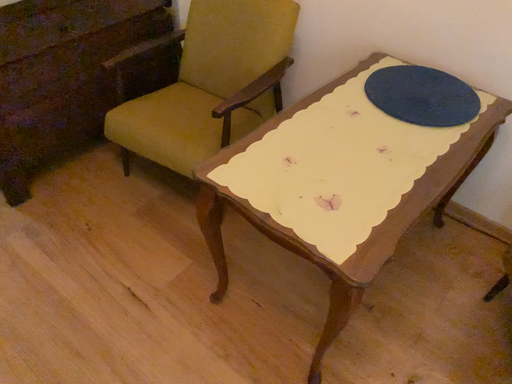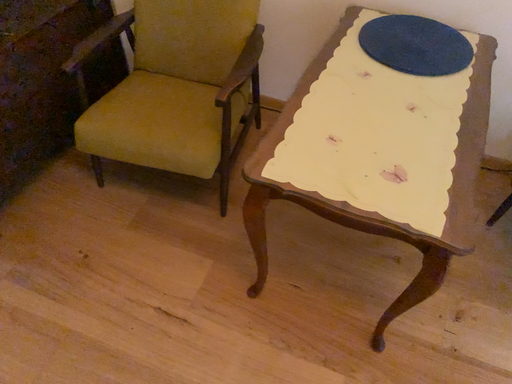
Question: Which way did the camera rotate in the video?

Choices:
 (A) rotated left
 (B) rotated right

Answer: (B)